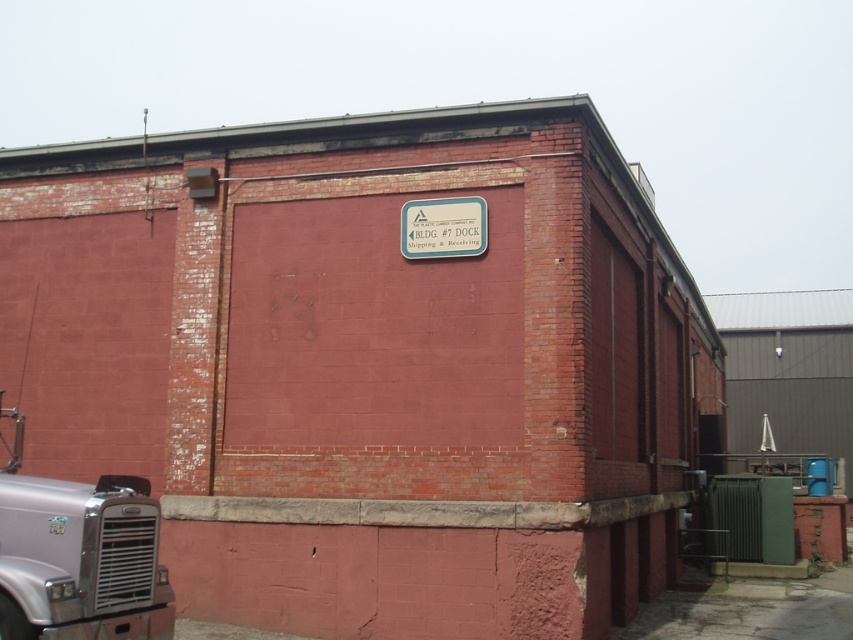
Does silver metallic truck at lower left come in front of metallic blue sign at center?

Yes, silver metallic truck at lower left is in front of metallic blue sign at center.

How far apart are silver metallic truck at lower left and metallic blue sign at center?

silver metallic truck at lower left is 4.40 meters away from metallic blue sign at center.

I want to click on silver metallic truck at lower left, so click(x=79, y=563).